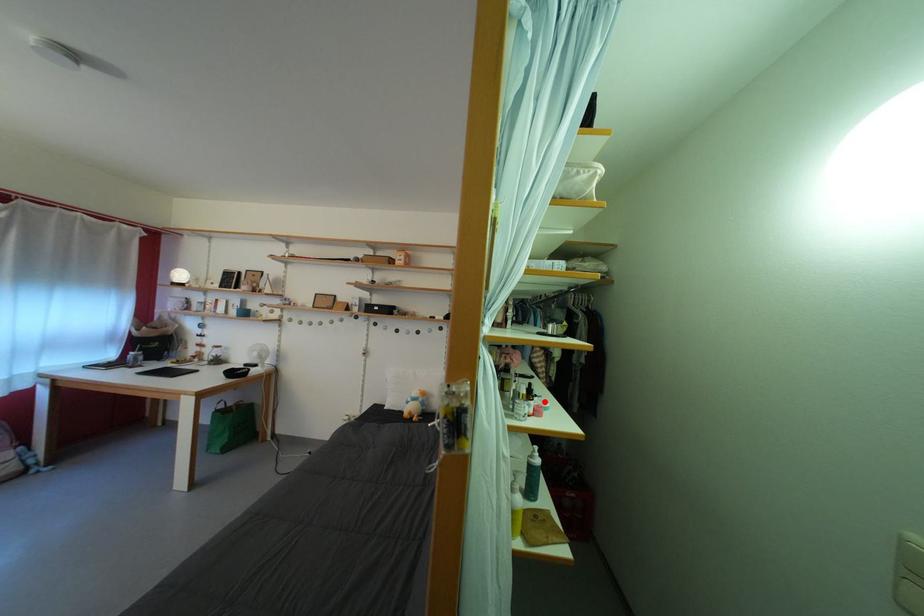
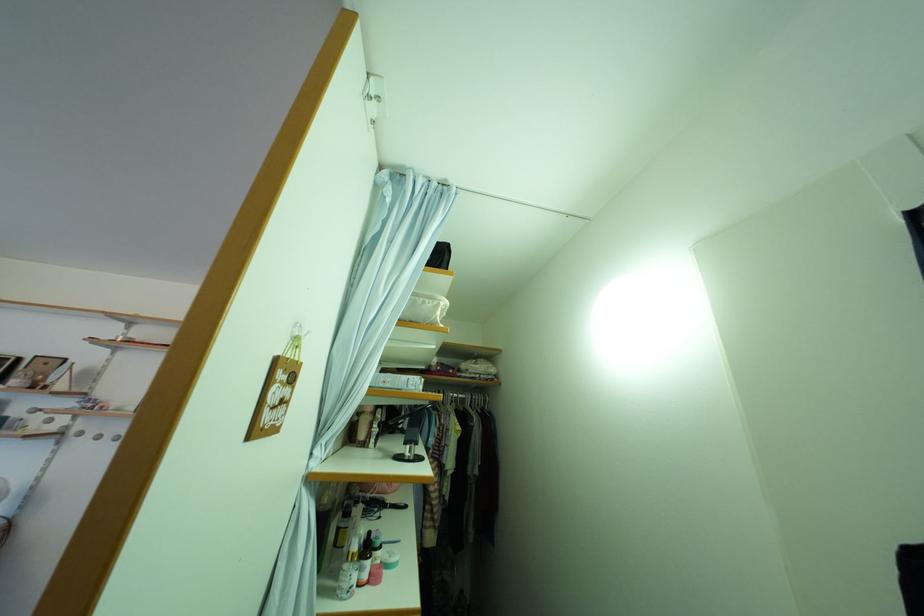
Where in the second image is the point corresponding to the highlighted location from the first image?

(390, 554)